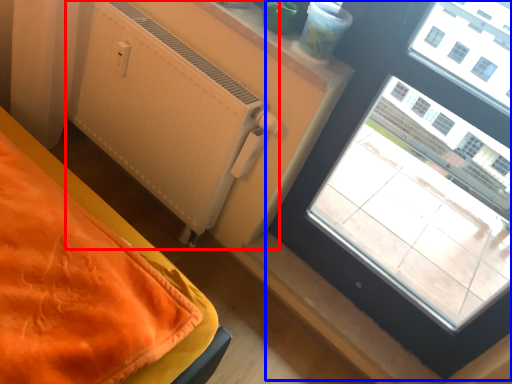
Question: Among these objects, which one is farthest to the camera, radiator (highlighted by a red box) or window (highlighted by a blue box)?

Choices:
 (A) radiator
 (B) window

Answer: (A)